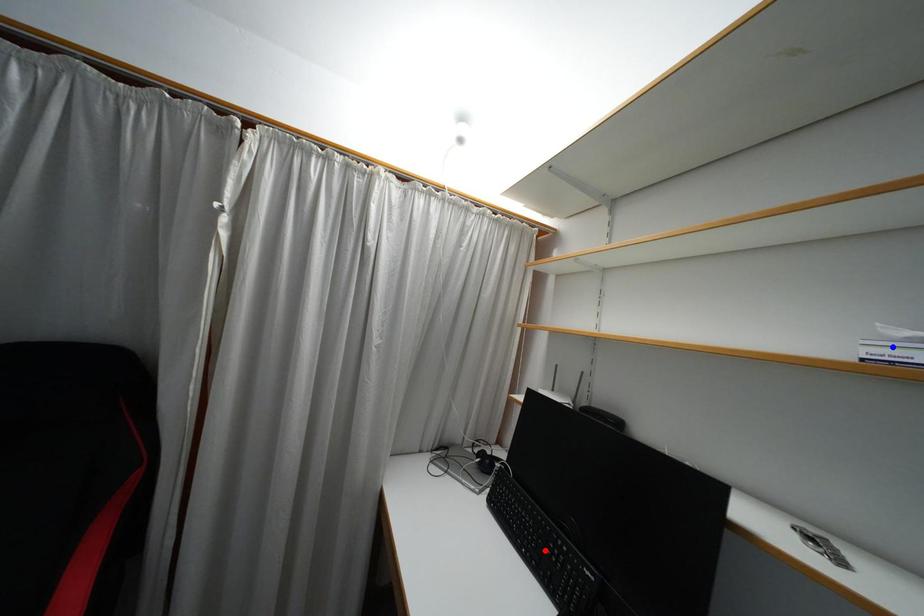
Question: Two points are marked on the image. Which point is closer to the camera?

Choices:
 (A) Blue point is closer.
 (B) Red point is closer.

Answer: (A)